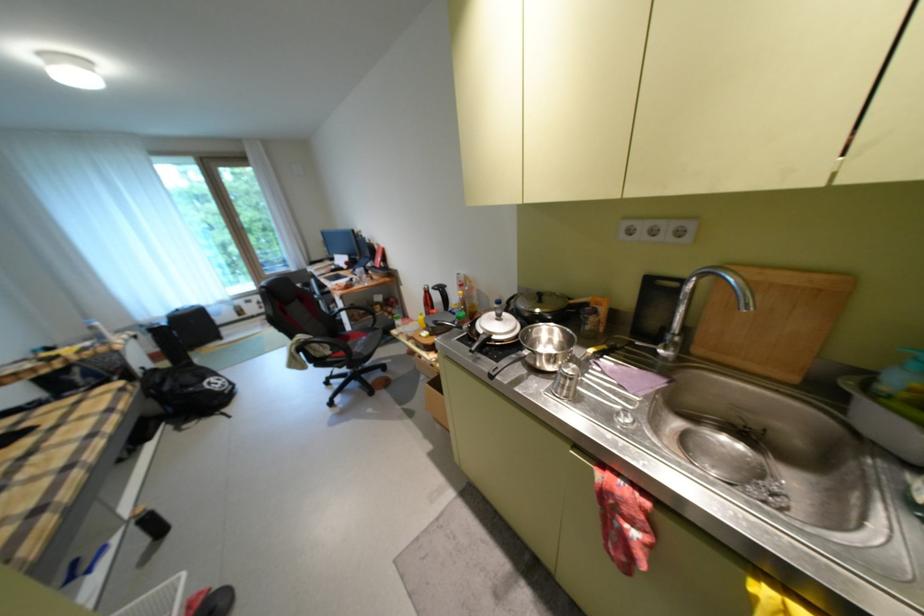
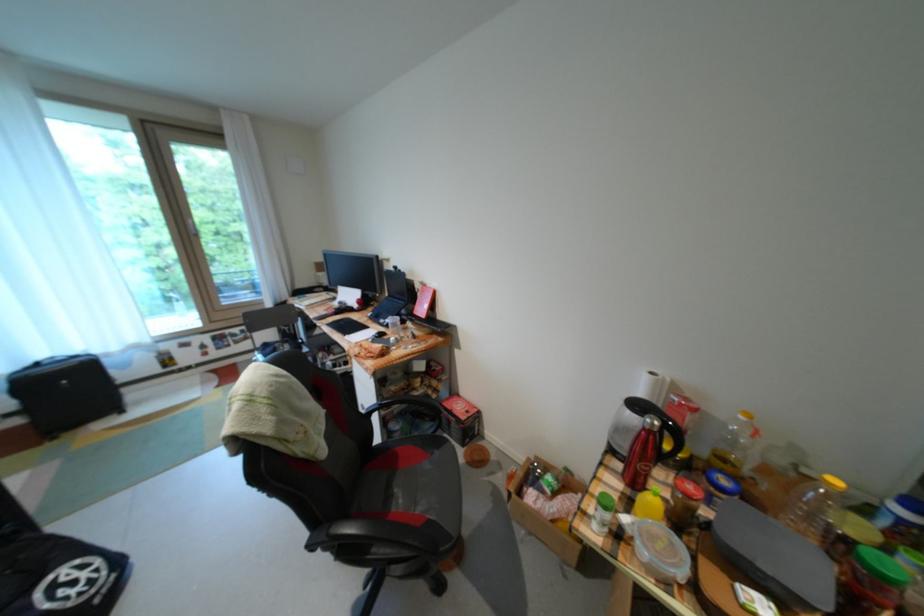
The point at (x=468, y=275) is marked in the first image. Where is the corresponding point in the second image?

(662, 374)